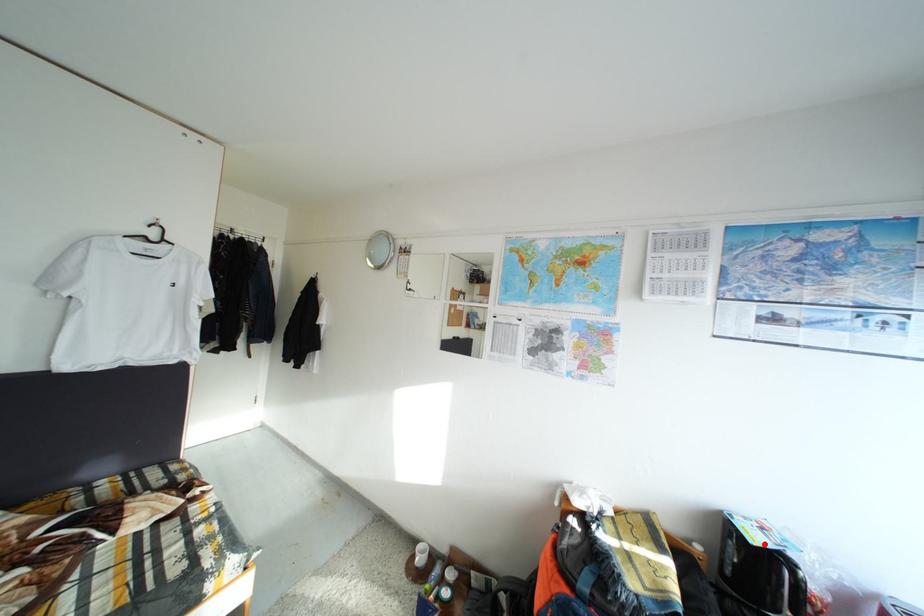
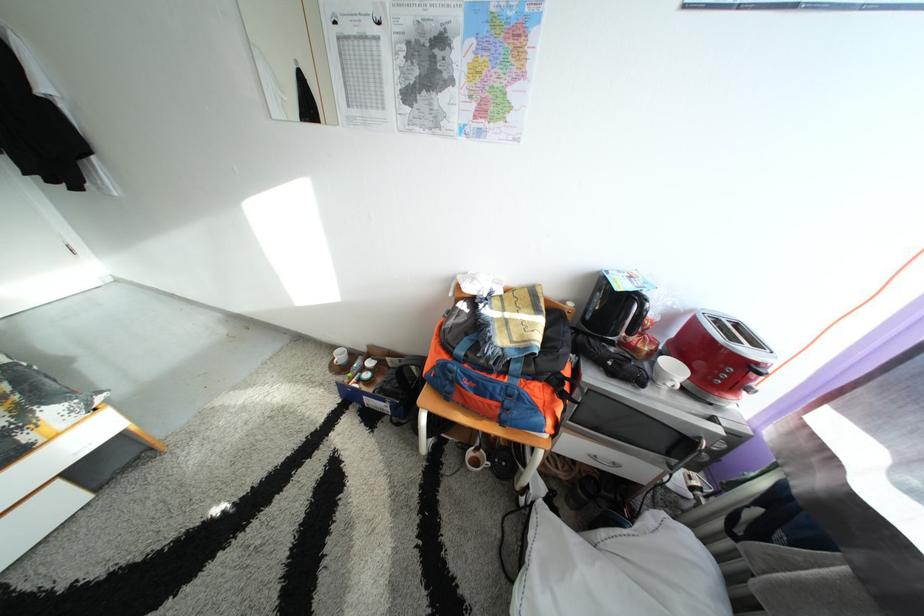
Find the pixel in the second image that matches the highlighted location in the first image.

(630, 292)